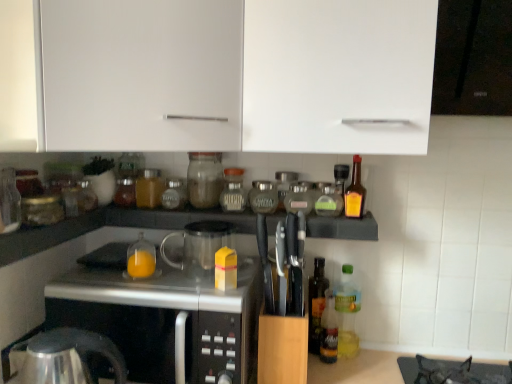
Question: From the image's perspective, is green glass bottle at center, placed as the 9th bottle when sorted from left to right, located above or below brown glass jar at center, the tenth bottle positioned from the right?

Choices:
 (A) below
 (B) above

Answer: (A)

Question: Is point (328, 195) positioned closer to the camera than point (132, 183)?

Choices:
 (A) closer
 (B) farther

Answer: (A)

Question: Which object is the closest to the translucent glass bottle at center, marked as the eighth bottle in a left-to-right arrangement?

Choices:
 (A) translucent plastic bottle at lower right, positioned as the tenth bottle in left-to-right order
 (B) translucent glass bottle at center, which is counted as the 2th orange juice, starting from the front
 (C) translucent glass jar at center, which ranks as the 5th bottle in left-to-right order
 (D) translucent glass jar at center, the 9th bottle in the right-to-left sequence
 (E) green glass bottle at center, the 4th bottle from the right

Answer: (A)

Question: Considering the real-world distances, which object is farthest from the matte glass jar at center, which is the 7th bottle in left-to-right order?

Choices:
 (A) translucent plastic bottle at lower right, positioned as the tenth bottle in left-to-right order
 (B) clear glass jar at left, positioned as the 2th bottle in left-to-right order
 (C) satin silver microwave at center
 (D) amber glass bottle at right, which appears as the 1th bottle when viewed from the right
 (E) translucent glass jar at center, which ranks as the 5th bottle in left-to-right order

Answer: (A)